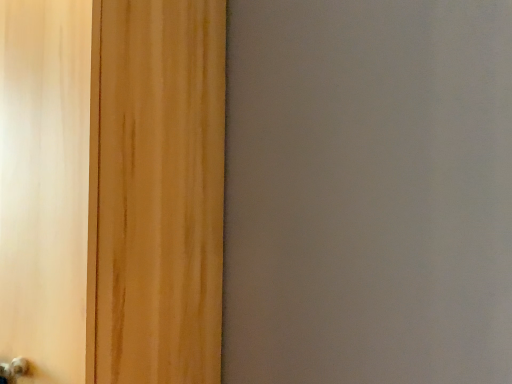
Where is `light wood door at left`? light wood door at left is located at coordinates (112, 189).

The height and width of the screenshot is (384, 512). Describe the element at coordinates (112, 189) in the screenshot. I see `light wood door at left` at that location.

Where is `light wood door at left`? The image size is (512, 384). light wood door at left is located at coordinates (112, 189).